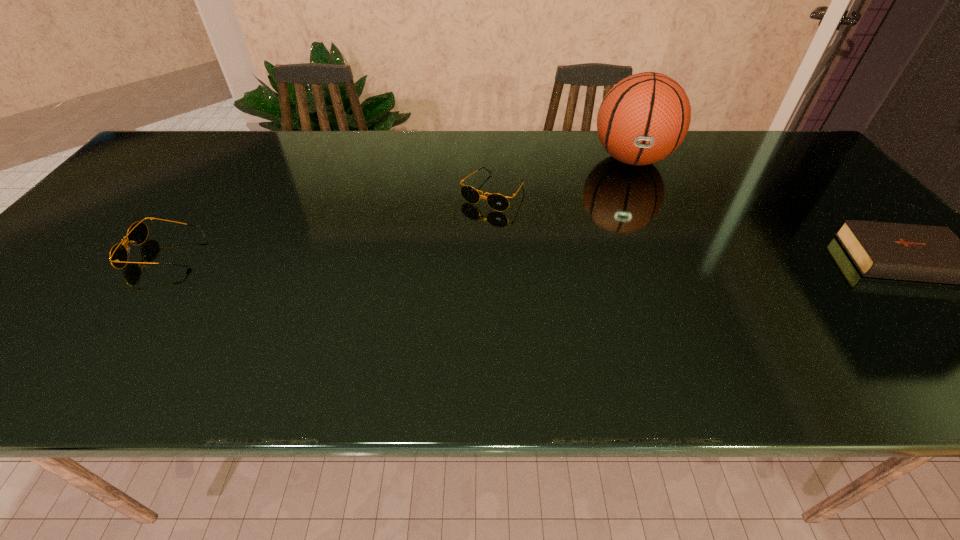
The height and width of the screenshot is (540, 960). What are the coordinates of `vacant space at the far left corner` in the screenshot? It's located at (222, 132).

Identify the location of vacant space at the near left corner. (12, 335).

Find the location of a particular element. The height and width of the screenshot is (540, 960). free space at the far right corner of the desktop is located at coordinates (758, 154).

Locate an element on the screen. Image resolution: width=960 pixels, height=540 pixels. free space between the right sunglasses and the left sunglasses is located at coordinates (330, 223).

The width and height of the screenshot is (960, 540). Find the location of `free space between the nearer sunglasses and the second object from left to right`. free space between the nearer sunglasses and the second object from left to right is located at coordinates (x=330, y=223).

Where is `free space between the leftmost object and the farther sunglasses`? free space between the leftmost object and the farther sunglasses is located at coordinates (330, 223).

Where is `vacant space in between the farther sunglasses and the second object from right to left`? The width and height of the screenshot is (960, 540). vacant space in between the farther sunglasses and the second object from right to left is located at coordinates (563, 176).

I want to click on unoccupied area between the basketball and the left sunglasses, so point(399,206).

Find the location of a particular element. Image resolution: width=960 pixels, height=540 pixels. free point between the basketball and the left sunglasses is located at coordinates (399, 206).

The width and height of the screenshot is (960, 540). In order to click on vacant area between the tallest object and the leftmost object in this screenshot , I will do `click(399, 206)`.